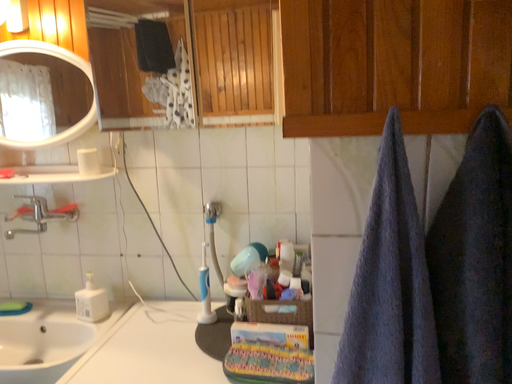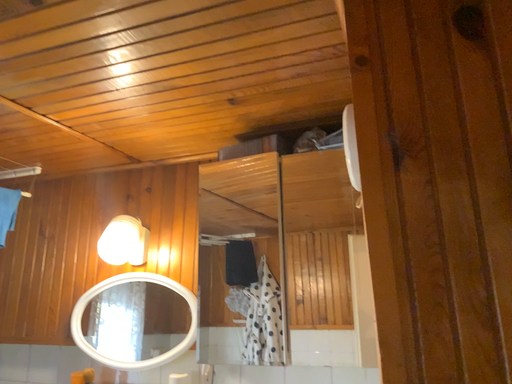
Question: Which way did the camera rotate in the video?

Choices:
 (A) rotated right
 (B) rotated left

Answer: (B)